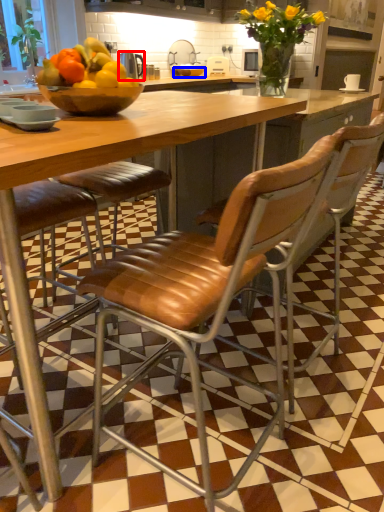
Question: Which object is further to the camera taking this photo, appliance (highlighted by a red box) or glass bowl (highlighted by a blue box)?

Choices:
 (A) appliance
 (B) glass bowl

Answer: (B)